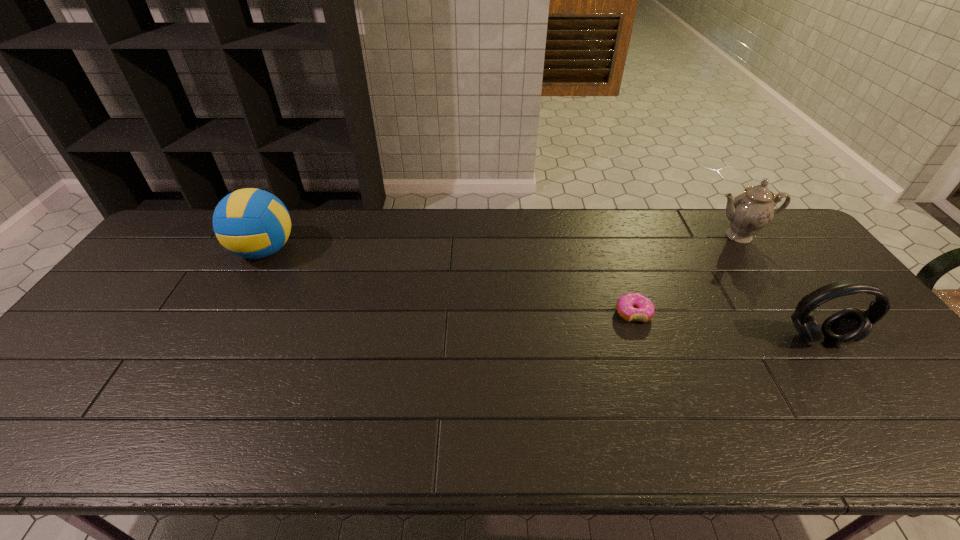
The image size is (960, 540). I want to click on chinaware, so click(749, 212).

Locate an element on the screen. The width and height of the screenshot is (960, 540). the leftmost object is located at coordinates (252, 223).

At what (x,y) coordinates should I click in order to perform the action: click on headset. Please return your answer as a coordinate pair (x, y). This screenshot has width=960, height=540. Looking at the image, I should click on (850, 325).

Locate an element on the screen. This screenshot has height=540, width=960. the shortest object is located at coordinates (632, 306).

You are a GUI agent. You are given a task and a screenshot of the screen. Output one action in this format:
    pyautogui.click(x=<x>, y=<y>)
    Task: Click on the second nearest object
    
    Given the screenshot: What is the action you would take?
    pyautogui.click(x=632, y=306)

The height and width of the screenshot is (540, 960). Identify the location of free spot located 0.100m on the spout of the chinaware. (761, 268).

What are the coordinates of `free region located 0.350m on the front of the volleyball` in the screenshot? It's located at (198, 370).

Where is `free space located 0.090m on the earcups of the nearest object`? This screenshot has width=960, height=540. free space located 0.090m on the earcups of the nearest object is located at coordinates pos(848,381).

Find the location of a particular element. vacant space located on the front of the shortest object is located at coordinates (680, 448).

Locate an element on the screen. The width and height of the screenshot is (960, 540). chinaware positioned at the far edge is located at coordinates (749, 212).